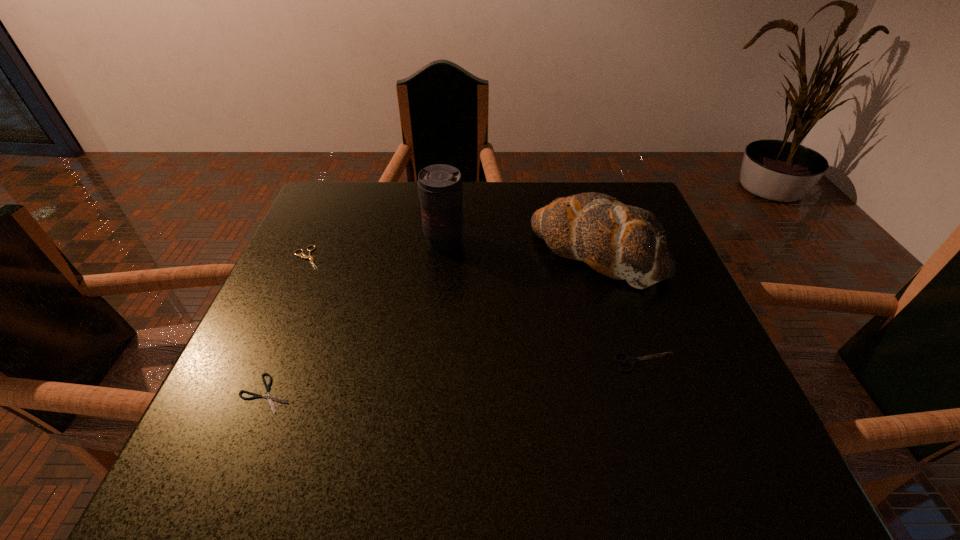
You are a GUI agent. You are given a task and a screenshot of the screen. Output one action in this format:
    pyautogui.click(x=<x>, y=<y>)
    Task: Click on the free location that satisfies the following two spatial constraints: 1. on the side of the third object from left to right where the control switches are located; 2. on the right side of the second tallest object
    This screenshot has width=960, height=540.
    Given the screenshot: What is the action you would take?
    pyautogui.click(x=444, y=252)

Where is `free location that satisfies the following two spatial constraints: 1. on the side of the third shortest object where the control switches are located; 2. on the right side of the telephoto lens`? free location that satisfies the following two spatial constraints: 1. on the side of the third shortest object where the control switches are located; 2. on the right side of the telephoto lens is located at coordinates (433, 362).

What are the coordinates of `free location that satisfies the following two spatial constraints: 1. on the side of the bread where the control switches are located; 2. on the left side of the tallest object` in the screenshot? It's located at (444, 252).